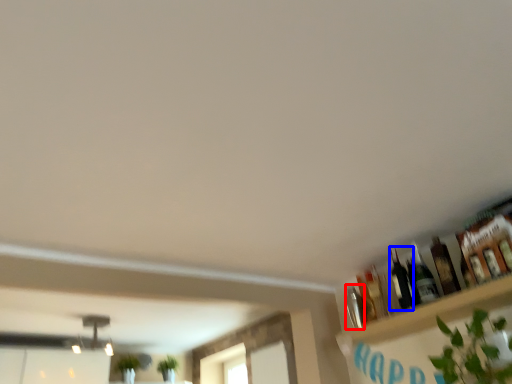
Question: Which point is closer to the camera, bottle (highlighted by a red box) or bottle (highlighted by a blue box)?

Choices:
 (A) bottle
 (B) bottle

Answer: (B)